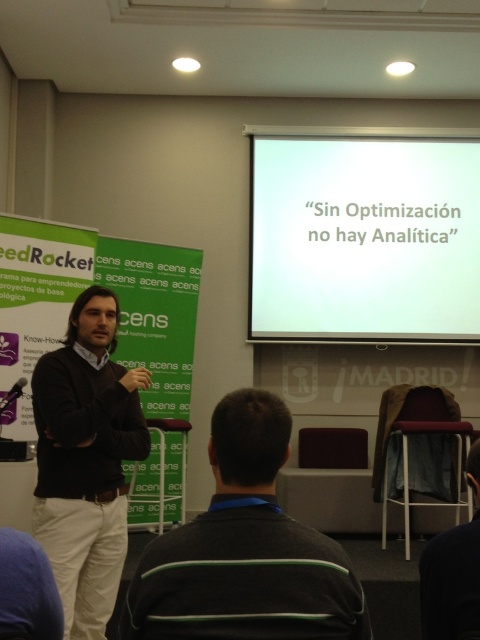
Question: Can you confirm if white matte projection screen at upper center is smaller than dark blue fabric at lower right?

Choices:
 (A) no
 (B) yes

Answer: (A)

Question: Can you confirm if white matte projection screen at upper center is smaller than dark blue fabric at lower right?

Choices:
 (A) yes
 (B) no

Answer: (B)

Question: Based on their relative distances, which object is nearer to the white matte projection screen at upper center?

Choices:
 (A) dark brown sweater at center
 (B) dark blue fabric at lower right
 (C) black sweater at center

Answer: (A)

Question: Which of the following is the closest to the observer?

Choices:
 (A) [243, 616]
 (B) [424, 557]
 (C) [323, 218]
 (D) [113, 529]

Answer: (A)

Question: Does white matte projection screen at upper center have a larger size compared to dark blue fabric at lower right?

Choices:
 (A) no
 (B) yes

Answer: (B)

Question: Estimate the real-world distances between objects in this image. Which object is farther from the dark brown sweater at center?

Choices:
 (A) black sweater at center
 (B) white matte projection screen at upper center
 (C) dark blue fabric at lower right

Answer: (B)